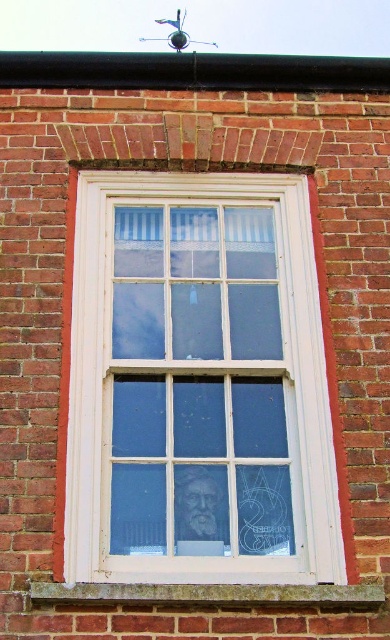
Is white wood window frame at center to the left of stone at lower center from the viewer's perspective?

Correct, you'll find white wood window frame at center to the left of stone at lower center.

Measure the distance between white wood window frame at center and camera.

A distance of 8.22 meters exists between white wood window frame at center and camera.

The height and width of the screenshot is (640, 390). Find the location of `white wood window frame at center`. white wood window frame at center is located at coordinates (198, 385).